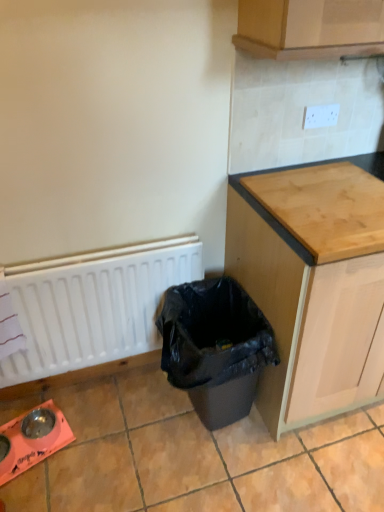
Find the location of a particular element. The height and width of the screenshot is (512, 384). black plastic waste bin at lower center is located at coordinates (215, 347).

What is the approximate width of black plastic waste bin at lower center?

The width of black plastic waste bin at lower center is 46.73 centimeters.

This screenshot has width=384, height=512. I want to click on wooden cabinet at right, so click(312, 286).

In order to click on black plastic waste bin at lower center in this screenshot , I will do click(215, 347).

Does point (340, 170) come in front of point (355, 362)?

No, (340, 170) is further to viewer.

Who is shorter, light brown wood at upper right or wooden cabinet at right?

light brown wood at upper right.

Is light brown wood at upper right closer to camera compared to wooden cabinet at right?

Yes, light brown wood at upper right is in front of wooden cabinet at right.

Is light brown wood at upper right inside the boundaries of wooden cabinet at right, or outside?

light brown wood at upper right exists entirely within wooden cabinet at right.

Would you say white matte radiator at lower left is part of wooden cabinet at right's contents?

No.

Which object is wider, wooden cabinet at right or white matte radiator at lower left?

With larger width is wooden cabinet at right.

Is point (292, 385) positioned behind point (29, 296)?

No, it is in front of (29, 296).

Consider the image. How much distance is there between wooden cabinet at right and white matte radiator at lower left?

wooden cabinet at right and white matte radiator at lower left are 55.55 centimeters apart from each other.

Do you think wooden cabinet at right is within light brown wood at upper right, or outside of it?

The correct answer is: outside.

Are wooden cabinet at right and light brown wood at upper right beside each other?

They are not placed beside each other.

Is wooden cabinet at right shorter than light brown wood at upper right?

In fact, wooden cabinet at right may be taller than light brown wood at upper right.

From a real-world perspective, is wooden cabinet at right under light brown wood at upper right?

Indeed, from a real-world perspective, wooden cabinet at right is positioned beneath light brown wood at upper right.

Would you consider white matte radiator at lower left to be distant from light brown wood at upper right?

No, white matte radiator at lower left is not far away from light brown wood at upper right.

You are a GUI agent. You are given a task and a screenshot of the screen. Output one action in this format:
    pyautogui.click(x=<x>, y=<y>)
    Task: Click on the radiator below the light brown wood at upper right (from a real-world perspective)
    Image resolution: width=384 pixels, height=512 pixels.
    Given the screenshot: What is the action you would take?
    pyautogui.click(x=94, y=305)

In the scene shown: Is white matte radiator at lower left facing towards light brown wood at upper right?

No, white matte radiator at lower left is not aimed at light brown wood at upper right.

Is white matte radiator at lower left completely or partially outside of light brown wood at upper right?

That's correct, white matte radiator at lower left is outside of light brown wood at upper right.

Locate an element on the screen. waste container below the light brown wood at upper right (from a real-world perspective) is located at coordinates (215, 347).

How many degrees apart are the facing directions of light brown wood at upper right and black plastic waste bin at lower center?

The angular difference between light brown wood at upper right and black plastic waste bin at lower center is 1.61 degrees.

Is light brown wood at upper right wider or thinner than black plastic waste bin at lower center?

In the image, light brown wood at upper right appears to be wider than black plastic waste bin at lower center.

Could you tell me if light brown wood at upper right is facing black plastic waste bin at lower center?

No.

From a real-world perspective, between black plastic waste bin at lower center and wooden cabinet at right, who is vertically higher?

wooden cabinet at right, from a real-world perspective.

Is black plastic waste bin at lower center facing away from wooden cabinet at right?

No, black plastic waste bin at lower center is not facing the opposite direction of wooden cabinet at right.

Which object is positioned more to the left, black plastic waste bin at lower center or wooden cabinet at right?

black plastic waste bin at lower center.

From the image's perspective, which is below, black plastic waste bin at lower center or wooden cabinet at right?

black plastic waste bin at lower center appears lower in the image.

In the image, is white matte radiator at lower left positioned in front of or behind wooden cabinet at right?

white matte radiator at lower left is positioned farther from the viewer than wooden cabinet at right.

Who is bigger, white matte radiator at lower left or wooden cabinet at right?

With larger size is wooden cabinet at right.

Considering the relative sizes of white matte radiator at lower left and wooden cabinet at right in the image provided, is white matte radiator at lower left wider than wooden cabinet at right?

In fact, white matte radiator at lower left might be narrower than wooden cabinet at right.

Image resolution: width=384 pixels, height=512 pixels. In order to click on countertop above the wooden cabinet at right (from a real-world perspective) in this screenshot , I will do `click(319, 208)`.

Locate an element on the screen. This screenshot has width=384, height=512. cabinetry lying above the white matte radiator at lower left (from the image's perspective) is located at coordinates (312, 286).

Which object lies further to the anchor point white matte radiator at lower left, light brown wood at upper right or wooden cabinet at right?

light brown wood at upper right.

Looking at the image, which one is located closer to wooden cabinet at right, white matte radiator at lower left or light brown wood at upper right?

light brown wood at upper right is closer to wooden cabinet at right.

From the picture: Which object lies nearer to the anchor point white matte radiator at lower left, wooden cabinet at right or light brown wood at upper right?

Based on the image, wooden cabinet at right appears to be nearer to white matte radiator at lower left.

When comparing their distances from wooden cabinet at right, does black plastic waste bin at lower center or white matte radiator at lower left seem further?

white matte radiator at lower left is further to wooden cabinet at right.

When comparing their distances from white matte radiator at lower left, does wooden cabinet at right or black plastic waste bin at lower center seem further?

wooden cabinet at right lies further to white matte radiator at lower left than the other object.

Based on the photo, when comparing their distances from light brown wood at upper right, does white matte radiator at lower left or wooden cabinet at right seem closer?

wooden cabinet at right lies closer to light brown wood at upper right than the other object.

Considering their positions, is white matte radiator at lower left positioned further to light brown wood at upper right than black plastic waste bin at lower center?

white matte radiator at lower left is further to light brown wood at upper right.

Estimate the real-world distances between objects in this image. Which object is closer to light brown wood at upper right, black plastic waste bin at lower center or white matte radiator at lower left?

black plastic waste bin at lower center lies closer to light brown wood at upper right than the other object.

The image size is (384, 512). In order to click on waste container located between white matte radiator at lower left and light brown wood at upper right in the left-right direction in this screenshot , I will do `click(215, 347)`.

Where is `countertop located between white matte radiator at lower left and wooden cabinet at right in the left-right direction`? This screenshot has width=384, height=512. countertop located between white matte radiator at lower left and wooden cabinet at right in the left-right direction is located at coordinates (319, 208).

This screenshot has width=384, height=512. I want to click on cabinetry that lies between light brown wood at upper right and black plastic waste bin at lower center from top to bottom, so click(x=312, y=286).

Image resolution: width=384 pixels, height=512 pixels. Find the location of `waste container between white matte radiator at lower left and wooden cabinet at right in the horizontal direction`. waste container between white matte radiator at lower left and wooden cabinet at right in the horizontal direction is located at coordinates (215, 347).